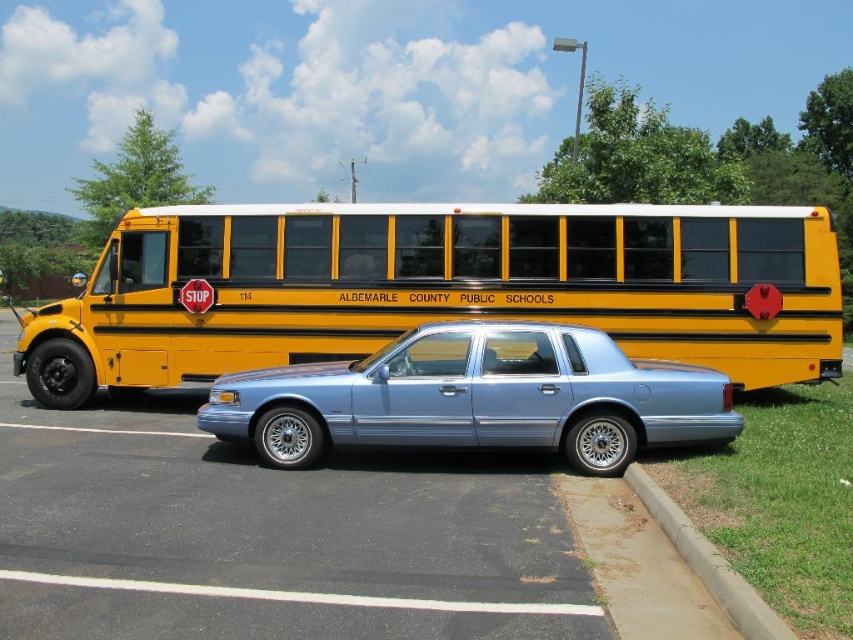
Does metallic blue sedan at center have a lesser height compared to concrete at lower right?

No.

Who is more forward, (579, 419) or (697, 532)?

Point (697, 532)

What do you see at coordinates (477, 397) in the screenshot? I see `metallic blue sedan at center` at bounding box center [477, 397].

Where is `metallic blue sedan at center`? This screenshot has width=853, height=640. metallic blue sedan at center is located at coordinates (477, 397).

Is yellow matte bus at center shorter than concrete at lower right?

No, yellow matte bus at center is not shorter than concrete at lower right.

Identify the location of yellow matte bus at center. (437, 288).

Where is `yellow matte bus at center`? Image resolution: width=853 pixels, height=640 pixels. yellow matte bus at center is located at coordinates (437, 288).

Is yellow matte bus at center smaller than metallic blue sedan at center?

Actually, yellow matte bus at center might be larger than metallic blue sedan at center.

Who is higher up, yellow matte bus at center or metallic blue sedan at center?

Positioned higher is yellow matte bus at center.

Consider the image. Who is more forward, (x=154, y=250) or (x=579, y=412)?

Point (x=579, y=412) is more forward.

Find the location of a particular element. yellow matte bus at center is located at coordinates (437, 288).